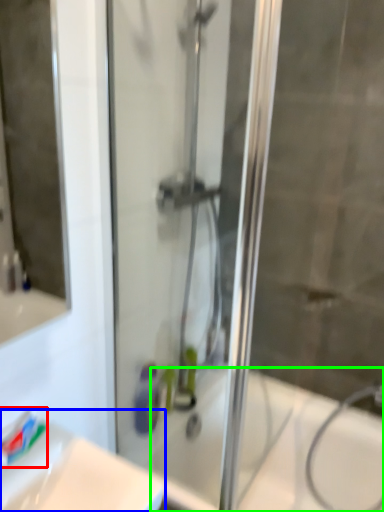
Question: Estimate the real-world distances between objects in this image. Which object is closer to toothpaste (highlighted by a red box), sink (highlighted by a blue box) or bath (highlighted by a green box)?

Choices:
 (A) sink
 (B) bath

Answer: (A)